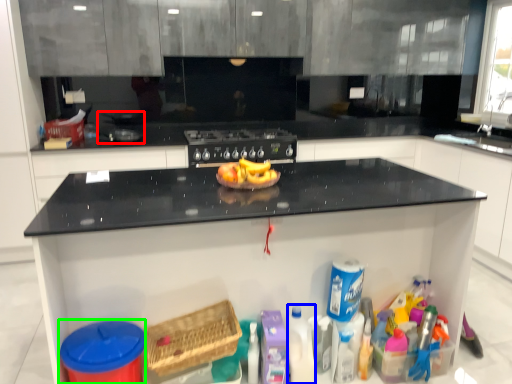
Question: Considering the real-world distances, which object is closest to appliance (highlighted by a red box)? cleaning product (highlighted by a blue box) or appliance (highlighted by a green box).

Choices:
 (A) cleaning product
 (B) appliance

Answer: (B)